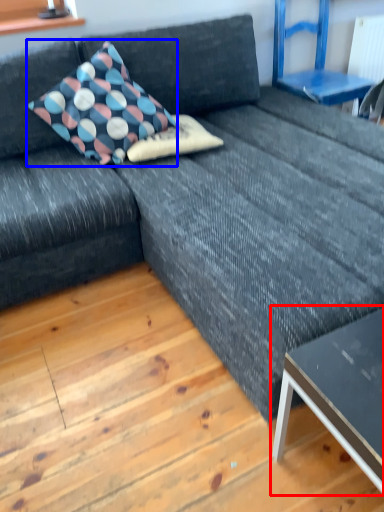
Question: Which object appears closest to the camera in this image, table (highlighted by a red box) or pillow (highlighted by a blue box)?

Choices:
 (A) table
 (B) pillow

Answer: (A)